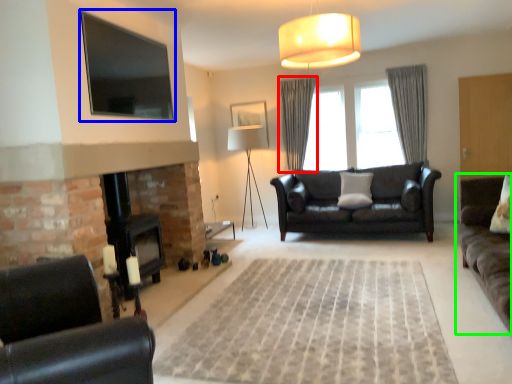
Question: Which object is positioned farthest from curtain (highlighted by a red box)? Select from window screen (highlighted by a blue box) and studio couch (highlighted by a green box).

Choices:
 (A) window screen
 (B) studio couch

Answer: (B)